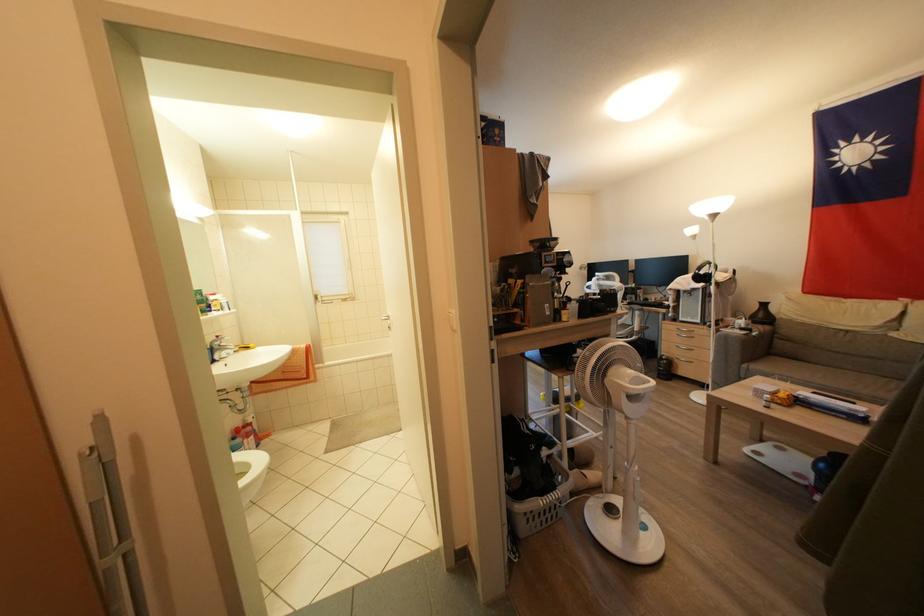
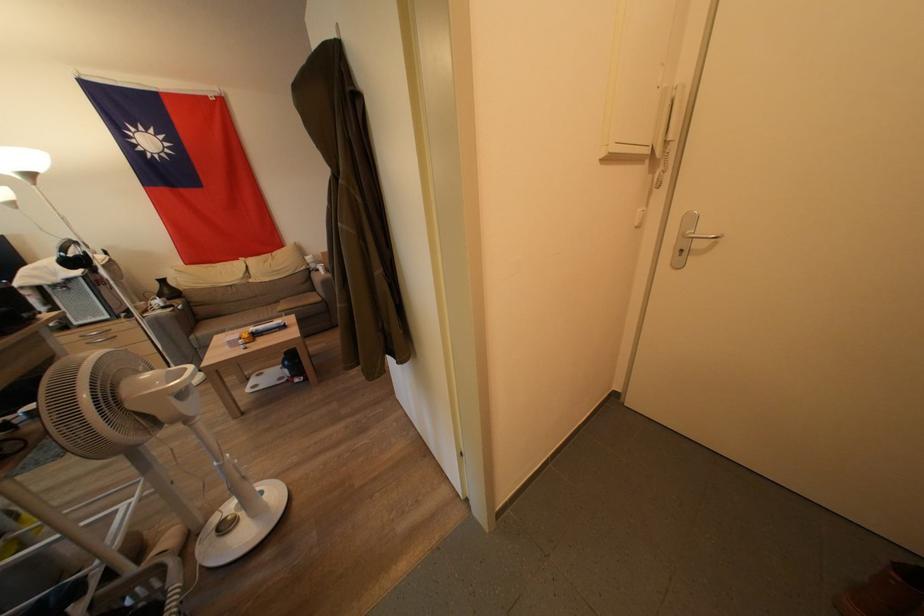
Find the pixel in the second image that matches (x=686, y=323) in the first image.

(81, 328)